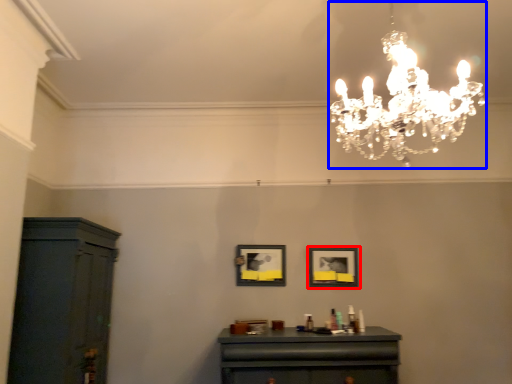
Question: Which object is further to the camera taking this photo, picture frame (highlighted by a red box) or lamp (highlighted by a blue box)?

Choices:
 (A) picture frame
 (B) lamp

Answer: (A)